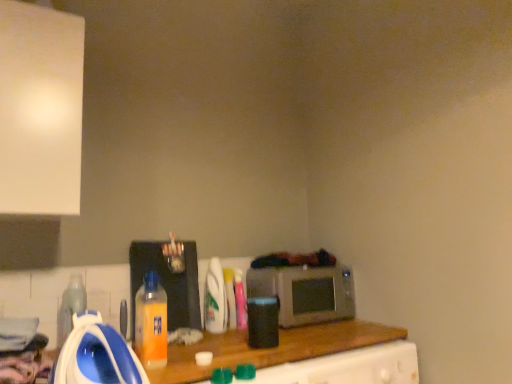
Question: Does orange plastic bottle at center, which is counted as the second bottle, starting from the left, have a smaller size compared to translucent plastic bottle at center, acting as the fourth bottle starting from the left?

Choices:
 (A) yes
 (B) no

Answer: (B)

Question: Is orange plastic bottle at center, acting as the fifth bottle starting from the back, positioned beyond the bounds of translucent plastic bottle at center, acting as the fourth bottle starting from the left?

Choices:
 (A) no
 (B) yes

Answer: (B)

Question: Is orange plastic bottle at center, which is counted as the second bottle, starting from the left, surrounding translucent plastic bottle at center, acting as the fourth bottle starting from the left?

Choices:
 (A) no
 (B) yes

Answer: (A)

Question: Is orange plastic bottle at center, which is counted as the second bottle, starting from the left, thinner than translucent plastic bottle at center, arranged as the 2th bottle when viewed from the right?

Choices:
 (A) yes
 (B) no

Answer: (B)

Question: Is orange plastic bottle at center, which is counted as the second bottle, starting from the left, bigger than translucent plastic bottle at center, arranged as the 2th bottle when viewed from the right?

Choices:
 (A) no
 (B) yes

Answer: (B)

Question: Is orange plastic bottle at center, which is counted as the 1th bottle, starting from the front, taller than translucent plastic bottle at center, placed as the fifth bottle when sorted from front to back?

Choices:
 (A) yes
 (B) no

Answer: (A)

Question: Can you confirm if metallic silver microwave at center is positioned to the left of orange plastic bottle at center, which is counted as the second bottle, starting from the left?

Choices:
 (A) no
 (B) yes

Answer: (A)

Question: Is metallic silver microwave at center with orange plastic bottle at center, which is counted as the 1th bottle, starting from the front?

Choices:
 (A) yes
 (B) no

Answer: (B)

Question: Is metallic silver microwave at center thinner than orange plastic bottle at center, acting as the fifth bottle starting from the back?

Choices:
 (A) no
 (B) yes

Answer: (A)

Question: Is metallic silver microwave at center facing away from orange plastic bottle at center, which is counted as the second bottle, starting from the left?

Choices:
 (A) no
 (B) yes

Answer: (A)

Question: From a real-world perspective, is metallic silver microwave at center positioned over orange plastic bottle at center, which is counted as the second bottle, starting from the left, based on gravity?

Choices:
 (A) no
 (B) yes

Answer: (A)

Question: Is metallic silver microwave at center in front of orange plastic bottle at center, which is counted as the second bottle, starting from the left?

Choices:
 (A) no
 (B) yes

Answer: (A)

Question: From a real-world perspective, is orange plastic bottle at center, which is counted as the 1th bottle, starting from the front, over translucent plastic bottle at lower left, which is the first bottle from left to right?

Choices:
 (A) yes
 (B) no

Answer: (A)